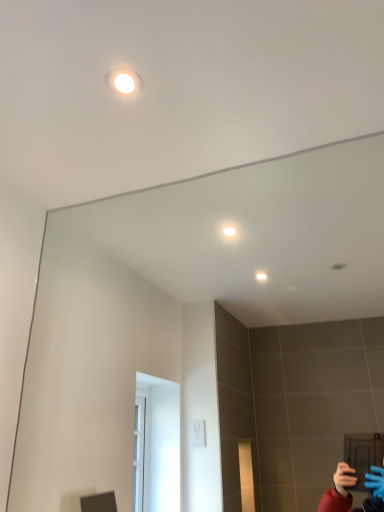
Describe the element at coordinates (208, 335) in the screenshot. I see `transparent glass mirror at upper center` at that location.

Measure the distance between transparent glass mirror at upper center and camera.

They are 4.25 feet apart.

This screenshot has height=512, width=384. What are the coordinates of `transparent glass mirror at upper center` in the screenshot? It's located at coord(208,335).

What is the approximate width of white glossy light at upper center?

The width of white glossy light at upper center is 3.49 inches.

Describe the element at coordinates (124, 82) in the screenshot. Image resolution: width=384 pixels, height=512 pixels. I see `white glossy light at upper center` at that location.

I want to click on white glossy light at upper center, so click(x=124, y=82).

Where is `transparent glass mirror at upper center`? transparent glass mirror at upper center is located at coordinates 208,335.

Considering the relative positions of transparent glass mirror at upper center and white glossy light at upper center in the image provided, is transparent glass mirror at upper center to the left of white glossy light at upper center from the viewer's perspective?

Incorrect, transparent glass mirror at upper center is not on the left side of white glossy light at upper center.

Which object is further away from the camera taking this photo, transparent glass mirror at upper center or white glossy light at upper center?

white glossy light at upper center is behind.

Does point (206, 471) come farther from viewer compared to point (129, 82)?

Yes, point (206, 471) is farther from viewer.

From the image's perspective, is transparent glass mirror at upper center positioned above or below white glossy light at upper center?

Based on their image positions, transparent glass mirror at upper center is located beneath white glossy light at upper center.

From a real-world perspective, between transparent glass mirror at upper center and white glossy light at upper center, who is vertically lower?

From a 3D spatial view, transparent glass mirror at upper center is below.

Is transparent glass mirror at upper center wider than white glossy light at upper center?

No, transparent glass mirror at upper center is not wider than white glossy light at upper center.

From their relative heights in the image, would you say transparent glass mirror at upper center is taller or shorter than white glossy light at upper center?

Clearly, transparent glass mirror at upper center is taller compared to white glossy light at upper center.

Considering the relative sizes of transparent glass mirror at upper center and white glossy light at upper center in the image provided, is transparent glass mirror at upper center smaller than white glossy light at upper center?

Actually, transparent glass mirror at upper center might be larger than white glossy light at upper center.

Is transparent glass mirror at upper center not inside white glossy light at upper center?

That's correct, transparent glass mirror at upper center is outside of white glossy light at upper center.

Are transparent glass mirror at upper center and white glossy light at upper center making contact?

No, transparent glass mirror at upper center is not in contact with white glossy light at upper center.

Is transparent glass mirror at upper center looking in the opposite direction of white glossy light at upper center?

transparent glass mirror at upper center does not have its back to white glossy light at upper center.

How far apart are transparent glass mirror at upper center and white glossy light at upper center?

transparent glass mirror at upper center is 4.30 feet from white glossy light at upper center.

I want to click on light that is above the transparent glass mirror at upper center (from a real-world perspective), so click(x=124, y=82).

Considering the relative positions of white glossy light at upper center and transparent glass mirror at upper center in the image provided, is white glossy light at upper center to the right of transparent glass mirror at upper center from the viewer's perspective?

Incorrect, white glossy light at upper center is not on the right side of transparent glass mirror at upper center.

Does white glossy light at upper center lie in front of transparent glass mirror at upper center?

No, it is not.

Between point (125, 75) and point (125, 271), which one is positioned behind?

The point (125, 271) is more distant.

From the image's perspective, is white glossy light at upper center under transparent glass mirror at upper center?

No, from the image's perspective, white glossy light at upper center is not below transparent glass mirror at upper center.

From a real-world perspective, is white glossy light at upper center on top of transparent glass mirror at upper center?

Indeed, from a real-world perspective, white glossy light at upper center stands above transparent glass mirror at upper center.

Is white glossy light at upper center wider or thinner than transparent glass mirror at upper center?

Clearly, white glossy light at upper center has more width compared to transparent glass mirror at upper center.

Considering the sizes of objects white glossy light at upper center and transparent glass mirror at upper center in the image provided, who is taller, white glossy light at upper center or transparent glass mirror at upper center?

transparent glass mirror at upper center.

Considering the sizes of objects white glossy light at upper center and transparent glass mirror at upper center in the image provided, who is bigger, white glossy light at upper center or transparent glass mirror at upper center?

transparent glass mirror at upper center.

Is white glossy light at upper center surrounding transparent glass mirror at upper center?

That's incorrect, transparent glass mirror at upper center is not inside white glossy light at upper center.

Is white glossy light at upper center not close to transparent glass mirror at upper center?

Yes, white glossy light at upper center is far from transparent glass mirror at upper center.

Is white glossy light at upper center facing towards transparent glass mirror at upper center?

No, white glossy light at upper center is not oriented towards transparent glass mirror at upper center.

Can you tell me how much white glossy light at upper center and transparent glass mirror at upper center differ in facing direction?

86 degrees.

Find the location of a particular element. The height and width of the screenshot is (512, 384). mirror below the white glossy light at upper center (from the image's perspective) is located at coordinates (208, 335).

Identify the location of mirror that is below the white glossy light at upper center (from the image's perspective). (208, 335).

Find the location of a particular element. This screenshot has width=384, height=512. light lying on the left of transparent glass mirror at upper center is located at coordinates (124, 82).